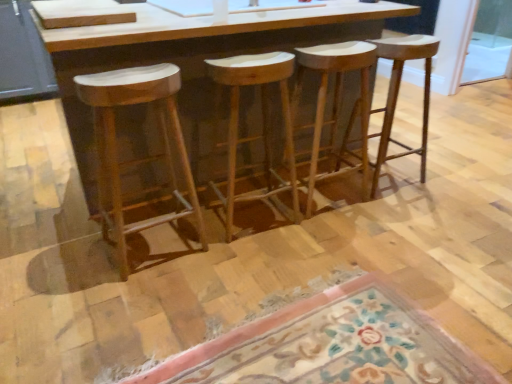
In order to click on free region under transparent glass screen door at upper right (from a real-world perspective) in this screenshot , I will do `click(478, 86)`.